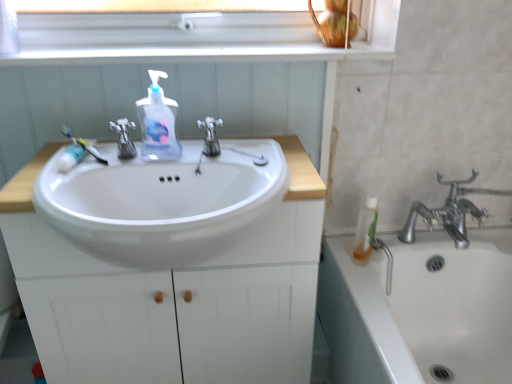
Question: Does point (374, 218) appear closer or farther from the camera than point (118, 125)?

Choices:
 (A) farther
 (B) closer

Answer: (A)

Question: Is translucent plastic bottle at right situated inside satin nickel faucet at center, acting as the first tap starting from the left, or outside?

Choices:
 (A) outside
 (B) inside

Answer: (A)

Question: Considering the real-world distances, which object is farthest from the translucent plastic soap dispenser at center?

Choices:
 (A) white glossy window sill at upper center
 (B) white glossy cabinet at center
 (C) white plastic toothbrush at left
 (D) satin nickel faucet at center, acting as the first tap starting from the left
 (E) white plastic window frame at upper center

Answer: (B)

Question: Based on their relative distances, which object is farther from the silver metallic faucet at center, acting as the 1th tap starting from the right?

Choices:
 (A) white plastic toothbrush at left
 (B) translucent plastic soap dispenser at center
 (C) satin nickel faucet at center, acting as the first tap starting from the left
 (D) white glossy cabinet at center
 (E) white glossy window sill at upper center

Answer: (D)